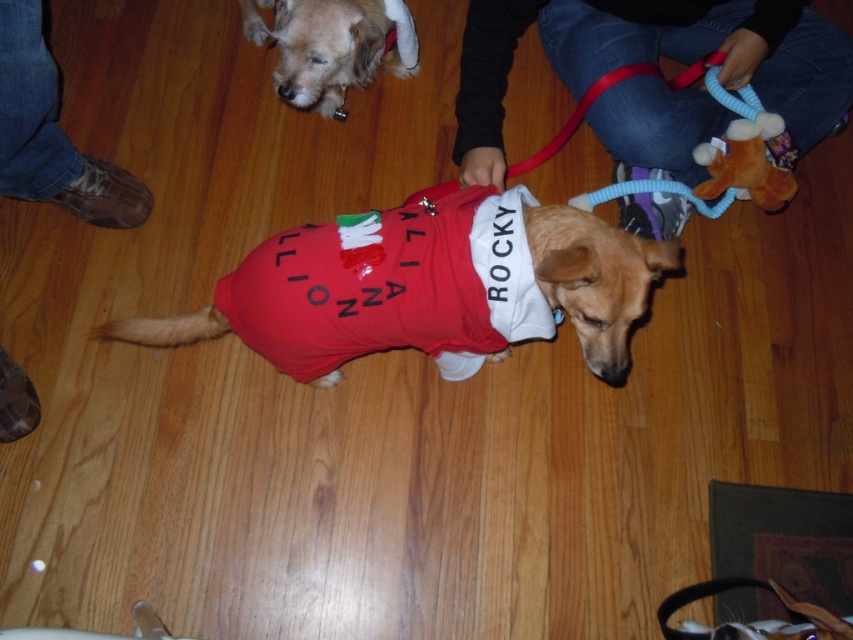
You are a dog groomer assessing two dogs in the scene. The first dog has light brown fur at upper center and the second has shiny brown fur at center. Which dog has wider fur coverage?

The light brown fur at upper center has wider fur coverage than the shiny brown fur at center because its width surpasses the other.

You are a dog trainer and need to ensure the shiny red fabric dog at center can reach the jeans at center without pulling the leash too hard. Given the leash length is 45.47 centimeters, will the dog be able to reach the jeans?

The shiny red fabric dog at center is 45.47 centimeters from the jeans at center, and the leash length is also 45.47 centimeters. Therefore, the dog can just barely reach the jeans at center without pulling too hard.

You are a dog trainer observing the scene. You need to decide which item is bigger between the shiny red fabric dog at center and the brown leather boot at lower left. Which one is bigger?

The shiny red fabric dog at center is larger in size than the brown leather boot at lower left.